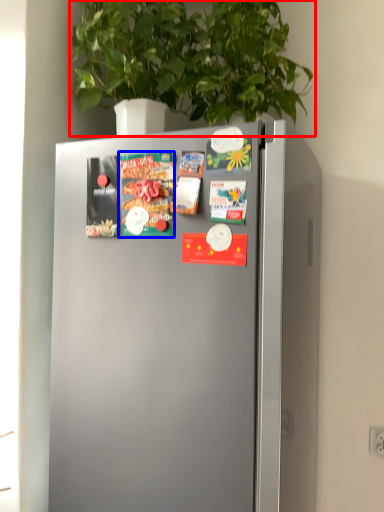
Question: Among these objects, which one is farthest to the camera, houseplant (highlighted by a red box) or magazine (highlighted by a blue box)?

Choices:
 (A) houseplant
 (B) magazine

Answer: (B)